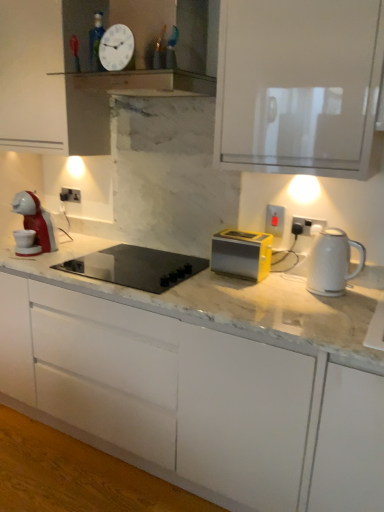
Question: In the image, is white glossy clock at upper center positioned in front of or behind white glossy electric kettle at right?

Choices:
 (A) behind
 (B) front

Answer: (A)

Question: Is white glossy clock at upper center taller or shorter than white glossy electric kettle at right?

Choices:
 (A) short
 (B) tall

Answer: (A)

Question: Considering the real-world distances, which object is closest to the black glass cooktop at center?

Choices:
 (A) white glossy clock at upper center
 (B) white plastic electric outlet at center-right, which ranks as the third electric outlet in left-to-right order
 (C) white plastic electric outlet at left, the third electric outlet from the bottom
 (D) matte plastic electric outlet at center-right, arranged as the second electric outlet when viewed from the right
 (E) white matte cabinet at center

Answer: (E)

Question: Which object is the closest to the black glass cooktop at center?

Choices:
 (A) white plastic electric outlet at center-right, which ranks as the third electric outlet in left-to-right order
 (B) white matte cabinet at center
 (C) white plastic electric outlet at left, the third electric outlet from the bottom
 (D) white glossy clock at upper center
 (E) matte plastic electric outlet at center-right, which is the second electric outlet in left-to-right order

Answer: (B)